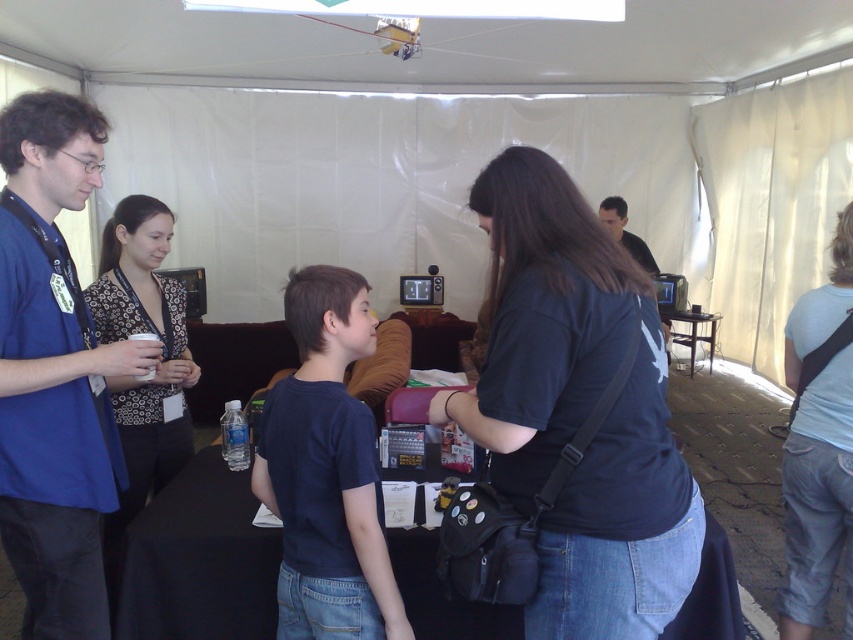
The image size is (853, 640). Describe the element at coordinates (577, 410) in the screenshot. I see `black cotton shirt at center` at that location.

Is point (573, 218) in front of point (643, 252)?

Yes, it is.

Identify the location of black cotton shirt at center. This screenshot has height=640, width=853. (577, 410).

Looking at this image, who is more distant from viewer, (55, 282) or (850, 380)?

The point (850, 380) is more distant.

Which is behind, point (32, 468) or point (827, 448)?

The point (827, 448) is more distant.

Where is `blue shirt at left`? Image resolution: width=853 pixels, height=640 pixels. blue shirt at left is located at coordinates (54, 372).

Can you confirm if blue shirt at left is positioned to the right of black matte shirt at upper center?

Incorrect, blue shirt at left is not on the right side of black matte shirt at upper center.

Where is `blue shirt at left`? blue shirt at left is located at coordinates (54, 372).